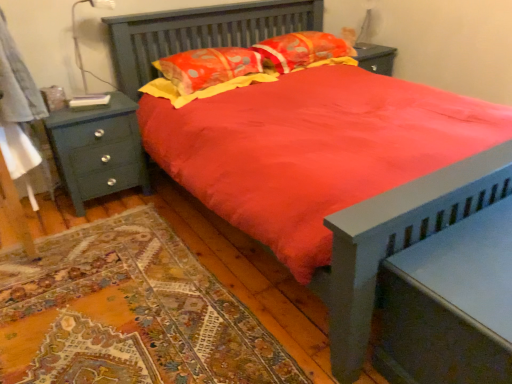
Question: Can you confirm if teal wood nightstand at left, arranged as the 2th nightstand when viewed from the right, is wider than matte gray nightstand at lower right, placed as the second nightstand when sorted from back to front?

Choices:
 (A) yes
 (B) no

Answer: (B)

Question: Does teal wood nightstand at left, marked as the 1th nightstand in a back-to-front arrangement, have a greater height compared to matte gray nightstand at lower right, which is counted as the second nightstand, starting from the top?

Choices:
 (A) no
 (B) yes

Answer: (B)

Question: From the image's perspective, does teal wood nightstand at left, which appears as the first nightstand when viewed from the top, appear higher than matte gray nightstand at lower right, marked as the first nightstand in a front-to-back arrangement?

Choices:
 (A) no
 (B) yes

Answer: (B)

Question: From a real-world perspective, is teal wood nightstand at left, the 2th nightstand in the bottom-to-top sequence, under matte gray nightstand at lower right, which is counted as the second nightstand, starting from the top?

Choices:
 (A) yes
 (B) no

Answer: (B)

Question: Considering the relative sizes of teal wood nightstand at left, the 2th nightstand in the bottom-to-top sequence, and matte gray nightstand at lower right, which ranks as the second nightstand in left-to-right order, in the image provided, is teal wood nightstand at left, the 2th nightstand in the bottom-to-top sequence, shorter than matte gray nightstand at lower right, which ranks as the second nightstand in left-to-right order,?

Choices:
 (A) no
 (B) yes

Answer: (A)

Question: Does point (180, 77) appear closer or farther from the camera than point (306, 64)?

Choices:
 (A) farther
 (B) closer

Answer: (B)

Question: Would you say quilted orange pillow at center, positioned as the first pillow in left-to-right order, is to the left or to the right of floral fabric pillow at upper center, which is the second pillow from left to right, in the picture?

Choices:
 (A) left
 (B) right

Answer: (A)

Question: Which is correct: quilted orange pillow at center, positioned as the first pillow in left-to-right order, is inside floral fabric pillow at upper center, which is the 1th pillow in right-to-left order, or outside of it?

Choices:
 (A) inside
 (B) outside

Answer: (B)

Question: Looking at their shapes, would you say quilted orange pillow at center, which ranks as the 2th pillow in right-to-left order, is wider or thinner than floral fabric pillow at upper center, which is the second pillow from left to right?

Choices:
 (A) thin
 (B) wide

Answer: (B)

Question: From their relative heights in the image, would you say metallic gray table lamp at upper left is taller or shorter than teal wood nightstand at left, marked as the 1th nightstand in a back-to-front arrangement?

Choices:
 (A) tall
 (B) short

Answer: (B)

Question: From the image's perspective, relative to teal wood nightstand at left, which appears as the first nightstand when viewed from the top, is metallic gray table lamp at upper left above or below?

Choices:
 (A) below
 (B) above

Answer: (B)

Question: Is point (99, 1) closer or farther from the camera than point (99, 155)?

Choices:
 (A) closer
 (B) farther

Answer: (B)

Question: Is metallic gray table lamp at upper left inside or outside of teal wood nightstand at left, marked as the 1th nightstand in a back-to-front arrangement?

Choices:
 (A) inside
 (B) outside

Answer: (B)

Question: Considering their positions, is metallic gray table lamp at upper left located in front of or behind floral fabric pillow at upper center, which is the 1th pillow in right-to-left order?

Choices:
 (A) behind
 (B) front

Answer: (B)

Question: Considering the positions of point (94, 74) and point (354, 52), is point (94, 74) closer or farther from the camera than point (354, 52)?

Choices:
 (A) farther
 (B) closer

Answer: (B)